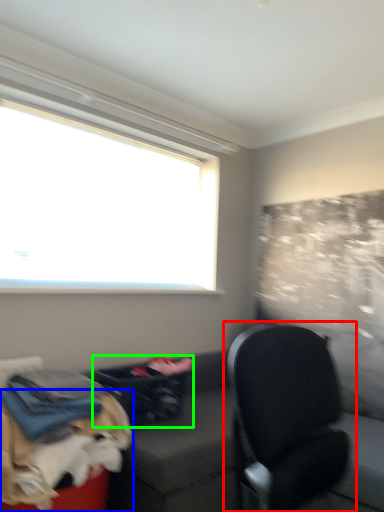
Question: Which is farther away from chair (highlighted by a red box)? dog (highlighted by a blue box) or laundry basket (highlighted by a green box)?

Choices:
 (A) dog
 (B) laundry basket

Answer: (B)